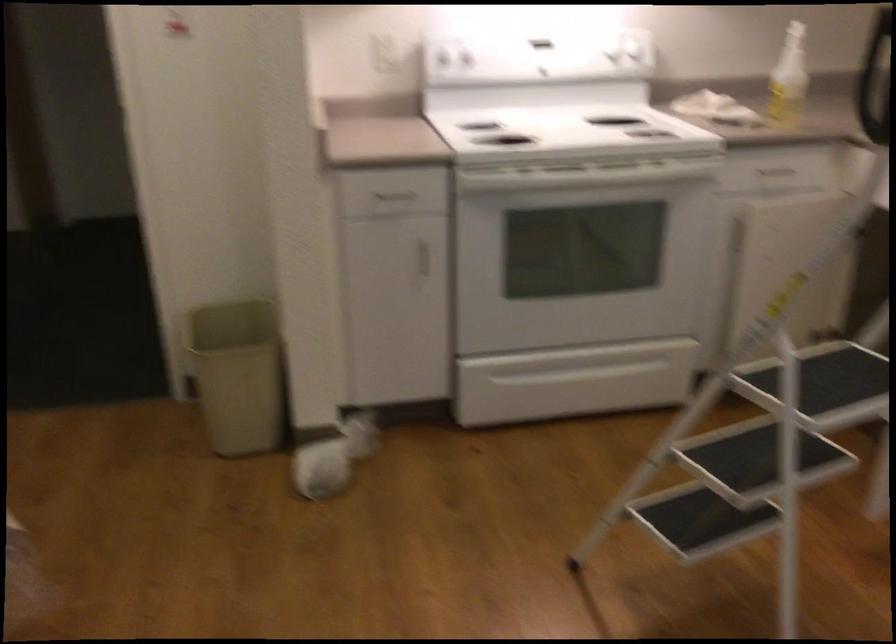
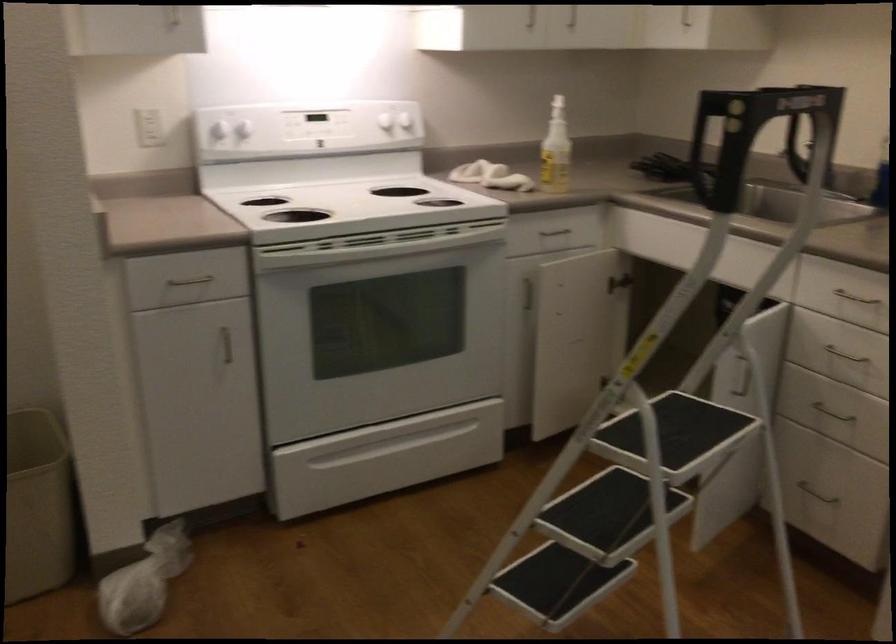
The point at (257, 377) is marked in the first image. Where is the corresponding point in the second image?

(38, 506)